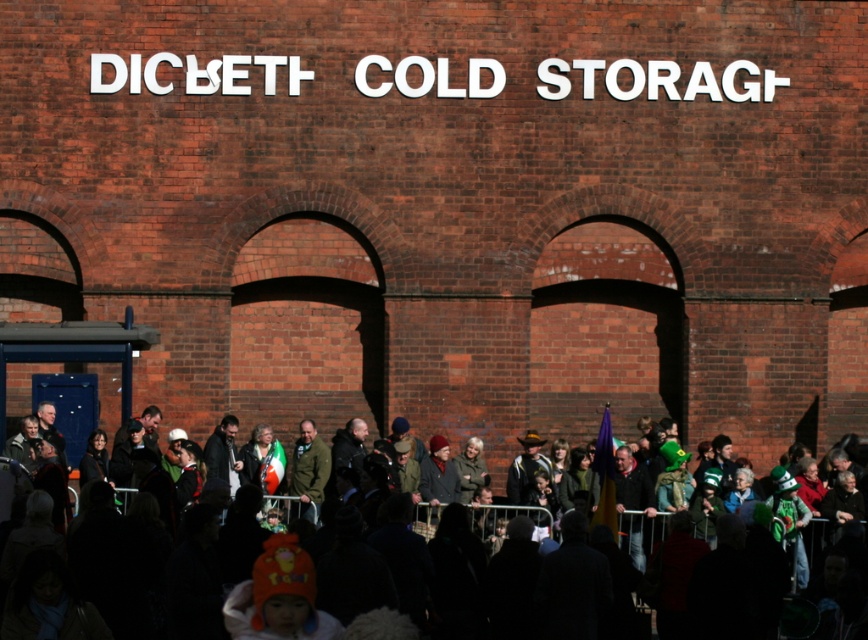
You are standing at the point marked as point (823, 532) in the image. What do you see around you?

You see dark clothing crowd at center around you.

You are a photographer trying to capture a clear photo of the green fabric jacket at center. The dark clothing crowd at center is blocking your view. Can you estimate whether the crowd is taller than the jacket?

The dark clothing crowd at center has a greater height compared to the green fabric jacket at center, so the crowd is taller than the jacket, making it harder to capture a clear photo.